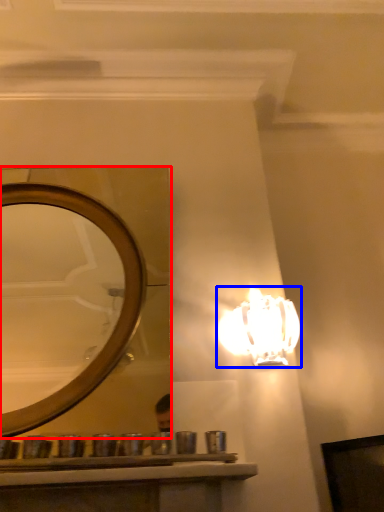
Question: Which point is further to the camera, mirror (highlighted by a red box) or lamp (highlighted by a blue box)?

Choices:
 (A) mirror
 (B) lamp

Answer: (B)